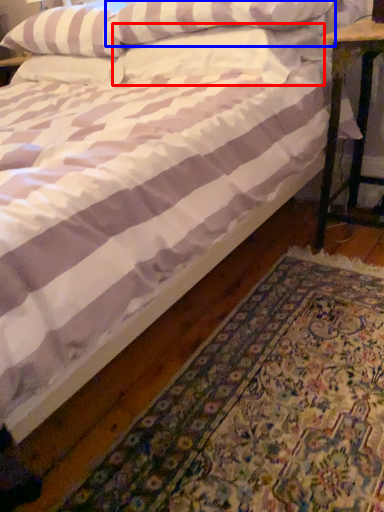
Question: Which of the following is the closest to the observer, pillow (highlighted by a red box) or pillow (highlighted by a blue box)?

Choices:
 (A) pillow
 (B) pillow

Answer: (B)